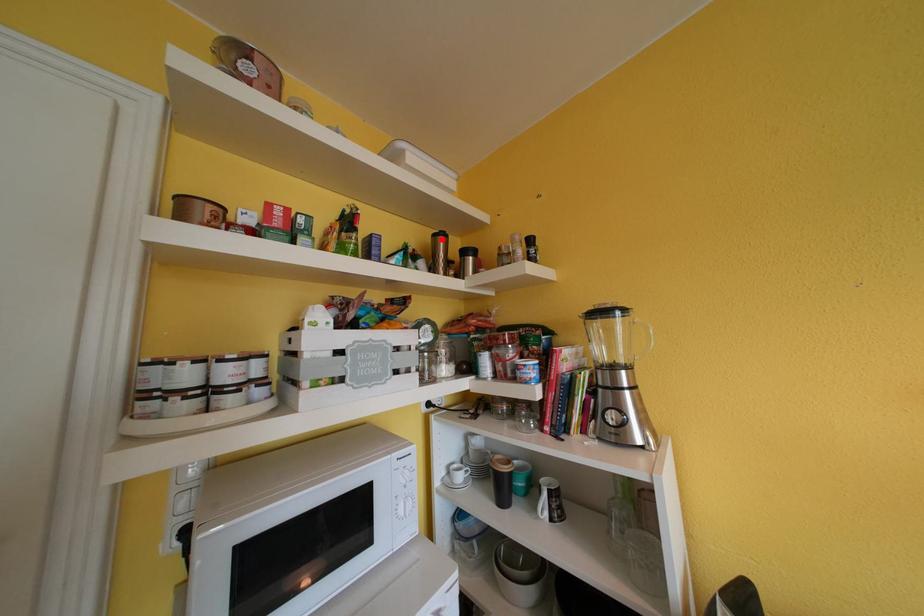
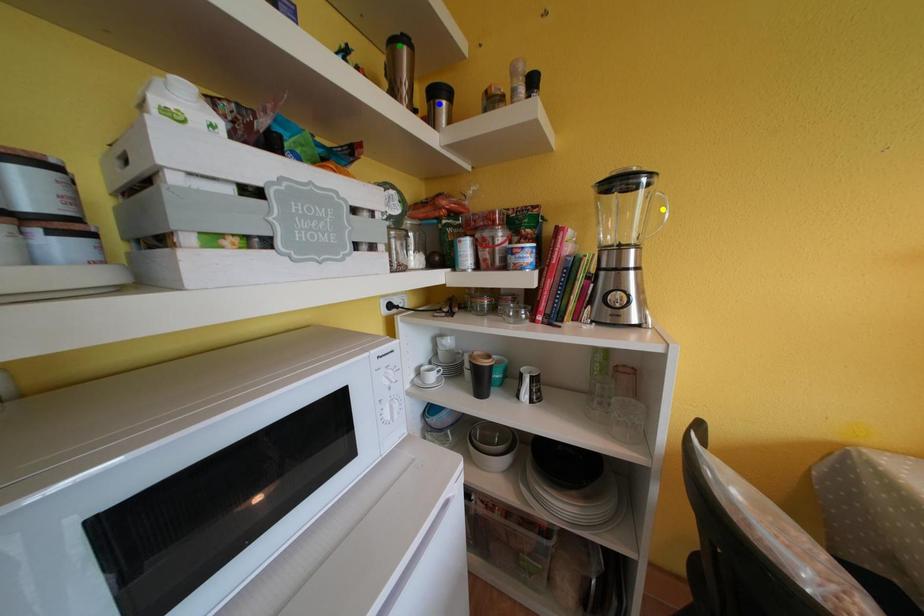
Question: I am providing you with two images of the same scene from different viewpoints. A red point is marked on the first image. You are given multiple points on the second image. Can you choose the point in image 2 that corresponds to the point in image 1?

Choices:
 (A) yellow point
 (B) green point
 (C) blue point

Answer: (B)